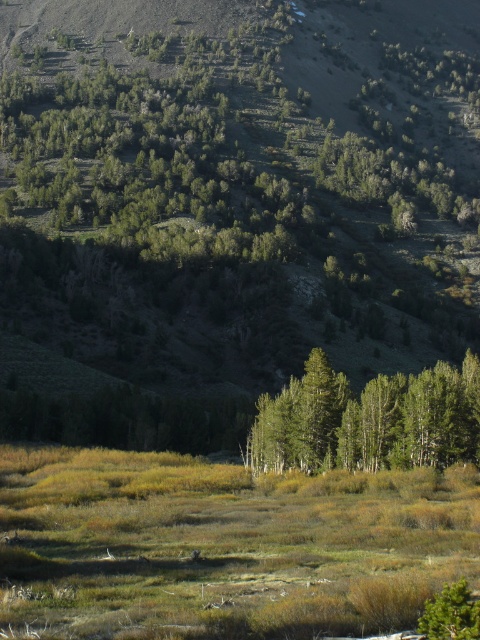
Based on the photo, you are navigating a drone through a mountainous area and need to avoid obstacles. Your current position is at coordinates point A. The green matte trees at center are at point B. Which direction should you steer the drone to move away from the trees?

The green matte trees at center are located at point B. To move away from them, you should steer the drone in the opposite direction of point B from your current position at point A.

You are a hiker trying to navigate through the mountainous area. You notice two green matte trees at center and a green matte tree at lower right. Which one would appear closer to you based on their sizes?

The green matte trees at center appears larger, so it would likely be closer to you than the green matte tree at lower right.